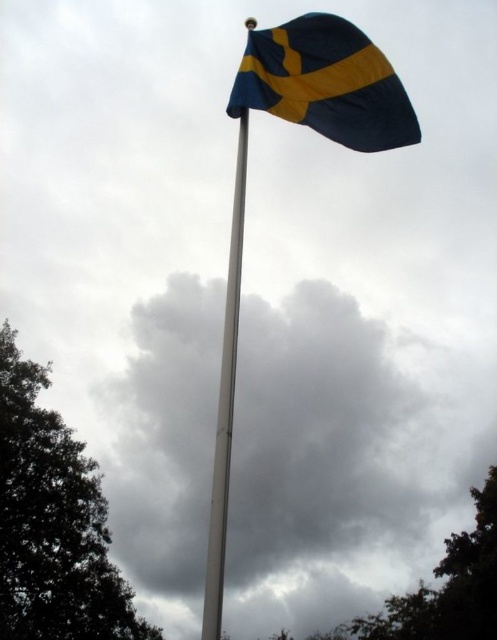
Question: Is cloudy gray sky at upper center thinner than blue fabric flag at upper center?

Choices:
 (A) no
 (B) yes

Answer: (A)

Question: Which object is positioned farthest from the white metallic pole at center?

Choices:
 (A) dark green leafy tree at lower left
 (B) cloudy gray sky at upper center
 (C) green leafy tree at lower right

Answer: (C)

Question: Is blue fabric flag at upper center behind green leafy tree at lower right?

Choices:
 (A) yes
 (B) no

Answer: (B)

Question: Among these points, which one is nearest to the camera?

Choices:
 (A) (29, 381)
 (B) (355, 67)
 (C) (451, 538)

Answer: (B)

Question: Where is cloudy gray sky at upper center located in relation to dark green leafy tree at lower left in the image?

Choices:
 (A) above
 (B) below

Answer: (B)

Question: Considering the real-world distances, which object is farthest from the blue fabric flag at upper center?

Choices:
 (A) dark green leafy tree at lower left
 (B) green leafy tree at lower right
 (C) cloudy gray sky at upper center

Answer: (C)